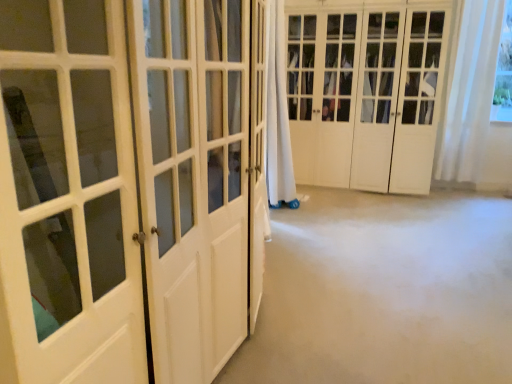
Question: From a real-world perspective, is white wood closet doors at center, which appears as the second door when viewed from the left, over white sheer curtain at upper right?

Choices:
 (A) no
 (B) yes

Answer: (A)

Question: Is white wood closet doors at center, which appears as the second door when viewed from the left, turned away from white sheer curtain at upper right?

Choices:
 (A) no
 (B) yes

Answer: (A)

Question: Are white wood closet doors at center, the first door positioned from the right, and white sheer curtain at upper right located far from each other?

Choices:
 (A) yes
 (B) no

Answer: (B)

Question: Could you tell me if white wood closet doors at center, the first door positioned from the right, is facing white sheer curtain at upper right?

Choices:
 (A) yes
 (B) no

Answer: (B)

Question: Can you confirm if white wood closet doors at center, the first door positioned from the right, is thinner than white sheer curtain at upper right?

Choices:
 (A) no
 (B) yes

Answer: (A)

Question: Can you confirm if white wood closet doors at center, which appears as the second door when viewed from the left, is positioned to the right of white sheer curtain at upper right?

Choices:
 (A) yes
 (B) no

Answer: (B)

Question: Considering the relative sizes of white glossy door at left, arranged as the first door when viewed from the front, and white wood closet doors at center, which appears as the second door when viewed from the left, in the image provided, is white glossy door at left, arranged as the first door when viewed from the front, shorter than white wood closet doors at center, which appears as the second door when viewed from the left,?

Choices:
 (A) yes
 (B) no

Answer: (A)

Question: Considering the relative positions of white glossy door at left, the 1th door when ordered from left to right, and white wood closet doors at center, the 2th door in the front-to-back sequence, in the image provided, is white glossy door at left, the 1th door when ordered from left to right, to the left of white wood closet doors at center, the 2th door in the front-to-back sequence, from the viewer's perspective?

Choices:
 (A) yes
 (B) no

Answer: (A)

Question: From a real-world perspective, is white glossy door at left, the 1th door when ordered from left to right, on white wood closet doors at center, which appears as the second door when viewed from the left?

Choices:
 (A) yes
 (B) no

Answer: (B)

Question: Could you tell me if white glossy door at left, the 1th door when ordered from left to right, is turned towards white wood closet doors at center, the 2th door in the front-to-back sequence?

Choices:
 (A) yes
 (B) no

Answer: (B)

Question: Is white glossy door at left, the 1th door when ordered from left to right, in front of white wood closet doors at center, the 2th door in the front-to-back sequence?

Choices:
 (A) yes
 (B) no

Answer: (A)

Question: Are white glossy door at left, arranged as the first door when viewed from the front, and white wood closet doors at center, the first door positioned from the back, located far from each other?

Choices:
 (A) yes
 (B) no

Answer: (A)

Question: Is white sheer curtain at upper right behind white wood closet doors at center, the 2th door in the front-to-back sequence?

Choices:
 (A) no
 (B) yes

Answer: (B)